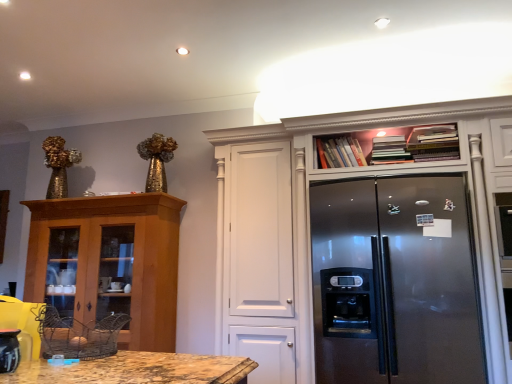
The height and width of the screenshot is (384, 512). I want to click on satin silver refrigerator at upper right, which appears as the 1th cabinetry when viewed from the right, so click(311, 212).

At what (x,y) coordinates should I click in order to perform the action: click on satin silver refrigerator at center. Please return your answer as a coordinate pair (x, y). The height and width of the screenshot is (384, 512). Looking at the image, I should click on (395, 282).

You are a GUI agent. You are given a task and a screenshot of the screen. Output one action in this format:
    pyautogui.click(x=<x>, y=<y>)
    Task: Click on the satin silver refrigerator at upper right, the second cabinetry in the left-to-right sequence
    
    Given the screenshot: What is the action you would take?
    pyautogui.click(x=311, y=212)

Who is smaller, satin silver refrigerator at center or wooden cabinet at left, which ranks as the 1th cabinetry in left-to-right order?

Smaller between the two is wooden cabinet at left, which ranks as the 1th cabinetry in left-to-right order.

Between satin silver refrigerator at center and wooden cabinet at left, which ranks as the 1th cabinetry in left-to-right order, which one has more height?

With more height is satin silver refrigerator at center.

Would you say wooden cabinet at left, positioned as the second cabinetry in right-to-left order, is part of satin silver refrigerator at center's contents?

Actually, wooden cabinet at left, positioned as the second cabinetry in right-to-left order, is outside satin silver refrigerator at center.

Which is more to the right, satin silver refrigerator at upper right, the second cabinetry in the left-to-right sequence, or satin silver refrigerator at center?

From the viewer's perspective, satin silver refrigerator at center appears more on the right side.

Does satin silver refrigerator at upper right, which appears as the 1th cabinetry when viewed from the right, have a greater width compared to satin silver refrigerator at center?

No, satin silver refrigerator at upper right, which appears as the 1th cabinetry when viewed from the right, is not wider than satin silver refrigerator at center.

Is satin silver refrigerator at upper right, which appears as the 1th cabinetry when viewed from the right, with satin silver refrigerator at center?

No, satin silver refrigerator at upper right, which appears as the 1th cabinetry when viewed from the right, is not next to satin silver refrigerator at center.

From the image's perspective, does satin silver refrigerator at center appear lower than satin silver refrigerator at upper right, which appears as the 1th cabinetry when viewed from the right?

Yes, from the image's perspective, satin silver refrigerator at center is beneath satin silver refrigerator at upper right, which appears as the 1th cabinetry when viewed from the right.

Would you say satin silver refrigerator at center is outside satin silver refrigerator at upper right, which appears as the 1th cabinetry when viewed from the right?

No, satin silver refrigerator at center is not outside of satin silver refrigerator at upper right, which appears as the 1th cabinetry when viewed from the right.

Consider the image. Between satin silver refrigerator at center and satin silver refrigerator at upper right, which appears as the 1th cabinetry when viewed from the right, which one has larger width?

Wider between the two is satin silver refrigerator at center.

Is satin silver refrigerator at center in contact with satin silver refrigerator at upper right, which appears as the 1th cabinetry when viewed from the right?

There is a gap between satin silver refrigerator at center and satin silver refrigerator at upper right, which appears as the 1th cabinetry when viewed from the right.

Is wooden cabinet at left, positioned as the second cabinetry in right-to-left order, inside matte black coffee pot at lower left?

No, wooden cabinet at left, positioned as the second cabinetry in right-to-left order, is not a part of matte black coffee pot at lower left.

This screenshot has height=384, width=512. Find the location of `cabinetry below the matte black coffee pot at lower left (from the image's perspective)`. cabinetry below the matte black coffee pot at lower left (from the image's perspective) is located at coordinates (113, 262).

Which object is further away from the camera, matte black coffee pot at lower left or wooden cabinet at left, which ranks as the 1th cabinetry in left-to-right order?

wooden cabinet at left, which ranks as the 1th cabinetry in left-to-right order, is behind.

Is matte black coffee pot at lower left not inside satin silver refrigerator at upper right, which appears as the 1th cabinetry when viewed from the right?

matte black coffee pot at lower left is positioned outside satin silver refrigerator at upper right, which appears as the 1th cabinetry when viewed from the right.

Is point (7, 365) more distant than point (411, 115)?

No, it is not.

Locate an element on the screen. This screenshot has height=384, width=512. appliance below the satin silver refrigerator at upper right, the second cabinetry in the left-to-right sequence (from the image's perspective) is located at coordinates (9, 350).

Would you consider matte black coffee pot at lower left to be distant from satin silver refrigerator at upper right, the second cabinetry in the left-to-right sequence?

Yes.

What's the angular difference between satin silver refrigerator at upper right, the second cabinetry in the left-to-right sequence, and wooden cabinet at left, positioned as the second cabinetry in right-to-left order,'s facing directions?

There is a 0.771-degree angle between the facing directions of satin silver refrigerator at upper right, the second cabinetry in the left-to-right sequence, and wooden cabinet at left, positioned as the second cabinetry in right-to-left order.

Between satin silver refrigerator at upper right, which appears as the 1th cabinetry when viewed from the right, and wooden cabinet at left, which ranks as the 1th cabinetry in left-to-right order, which one appears on the right side from the viewer's perspective?

satin silver refrigerator at upper right, which appears as the 1th cabinetry when viewed from the right.

Does satin silver refrigerator at upper right, the second cabinetry in the left-to-right sequence, turn towards wooden cabinet at left, positioned as the second cabinetry in right-to-left order?

No, satin silver refrigerator at upper right, the second cabinetry in the left-to-right sequence, does not turn towards wooden cabinet at left, positioned as the second cabinetry in right-to-left order.

Could you measure the distance between satin silver refrigerator at upper right, which appears as the 1th cabinetry when viewed from the right, and wooden cabinet at left, which ranks as the 1th cabinetry in left-to-right order?

satin silver refrigerator at upper right, which appears as the 1th cabinetry when viewed from the right, and wooden cabinet at left, which ranks as the 1th cabinetry in left-to-right order, are 37.05 inches apart from each other.

Is wooden cabinet at left, which ranks as the 1th cabinetry in left-to-right order, facing away from satin silver refrigerator at center?

wooden cabinet at left, which ranks as the 1th cabinetry in left-to-right order, does not have its back to satin silver refrigerator at center.

Between point (105, 213) and point (335, 237), which one is positioned behind?

The point (105, 213) is more distant.

Considering the sizes of objects wooden cabinet at left, which ranks as the 1th cabinetry in left-to-right order, and satin silver refrigerator at center in the image provided, who is taller, wooden cabinet at left, which ranks as the 1th cabinetry in left-to-right order, or satin silver refrigerator at center?

satin silver refrigerator at center.

Based on their positions, is wooden cabinet at left, positioned as the second cabinetry in right-to-left order, located to the left or right of satin silver refrigerator at center?

From the image, it's evident that wooden cabinet at left, positioned as the second cabinetry in right-to-left order, is to the left of satin silver refrigerator at center.

You are a GUI agent. You are given a task and a screenshot of the screen. Output one action in this format:
    pyautogui.click(x=<x>, y=<y>)
    Task: Click on the 2nd cabinetry to the left of the satin silver refrigerator at center, starting your count from the anchor
    
    Given the screenshot: What is the action you would take?
    pyautogui.click(x=113, y=262)

Find the location of a particular element. This screenshot has height=384, width=512. refrigerator lying on the right of satin silver refrigerator at upper right, the second cabinetry in the left-to-right sequence is located at coordinates (395, 282).

When comparing their distances from satin silver refrigerator at upper right, which appears as the 1th cabinetry when viewed from the right, does satin silver refrigerator at center or wooden cabinet at left, which ranks as the 1th cabinetry in left-to-right order, seem further?

The object further to satin silver refrigerator at upper right, which appears as the 1th cabinetry when viewed from the right, is wooden cabinet at left, which ranks as the 1th cabinetry in left-to-right order.

Looking at the image, which one is located further to satin silver refrigerator at upper right, the second cabinetry in the left-to-right sequence, matte black coffee pot at lower left or satin silver refrigerator at center?

matte black coffee pot at lower left is further to satin silver refrigerator at upper right, the second cabinetry in the left-to-right sequence.

Considering their positions, is wooden cabinet at left, which ranks as the 1th cabinetry in left-to-right order, positioned closer to satin silver refrigerator at upper right, which appears as the 1th cabinetry when viewed from the right, than matte black coffee pot at lower left?

wooden cabinet at left, which ranks as the 1th cabinetry in left-to-right order, is closer to satin silver refrigerator at upper right, which appears as the 1th cabinetry when viewed from the right.

When comparing their distances from wooden cabinet at left, positioned as the second cabinetry in right-to-left order, does matte black coffee pot at lower left or satin silver refrigerator at upper right, the second cabinetry in the left-to-right sequence, seem further?

The object further to wooden cabinet at left, positioned as the second cabinetry in right-to-left order, is matte black coffee pot at lower left.

Consider the image. Estimate the real-world distances between objects in this image. Which object is closer to matte black coffee pot at lower left, satin silver refrigerator at upper right, which appears as the 1th cabinetry when viewed from the right, or satin silver refrigerator at center?

satin silver refrigerator at center lies closer to matte black coffee pot at lower left than the other object.

Considering their positions, is satin silver refrigerator at upper right, which appears as the 1th cabinetry when viewed from the right, positioned further to matte black coffee pot at lower left than wooden cabinet at left, which ranks as the 1th cabinetry in left-to-right order?

Among the two, satin silver refrigerator at upper right, which appears as the 1th cabinetry when viewed from the right, is located further to matte black coffee pot at lower left.

Considering their positions, is satin silver refrigerator at center positioned closer to matte black coffee pot at lower left than satin silver refrigerator at upper right, which appears as the 1th cabinetry when viewed from the right?

satin silver refrigerator at center lies closer to matte black coffee pot at lower left than the other object.

Estimate the real-world distances between objects in this image. Which object is closer to matte black coffee pot at lower left, wooden cabinet at left, positioned as the second cabinetry in right-to-left order, or satin silver refrigerator at upper right, which appears as the 1th cabinetry when viewed from the right?

wooden cabinet at left, positioned as the second cabinetry in right-to-left order.

Where is `cabinetry located between wooden cabinet at left, positioned as the second cabinetry in right-to-left order, and satin silver refrigerator at center in the left-right direction`? cabinetry located between wooden cabinet at left, positioned as the second cabinetry in right-to-left order, and satin silver refrigerator at center in the left-right direction is located at coordinates (311, 212).

You are a GUI agent. You are given a task and a screenshot of the screen. Output one action in this format:
    pyautogui.click(x=<x>, y=<y>)
    Task: Click on the cabinetry situated between matte black coffee pot at lower left and satin silver refrigerator at center from left to right
    The width and height of the screenshot is (512, 384).
    Given the screenshot: What is the action you would take?
    pyautogui.click(x=311, y=212)

Locate an element on the screen. This screenshot has height=384, width=512. appliance situated between wooden cabinet at left, positioned as the second cabinetry in right-to-left order, and satin silver refrigerator at upper right, the second cabinetry in the left-to-right sequence, from left to right is located at coordinates 9,350.

This screenshot has width=512, height=384. Identify the location of appliance between wooden cabinet at left, positioned as the second cabinetry in right-to-left order, and satin silver refrigerator at center from left to right. (9, 350).